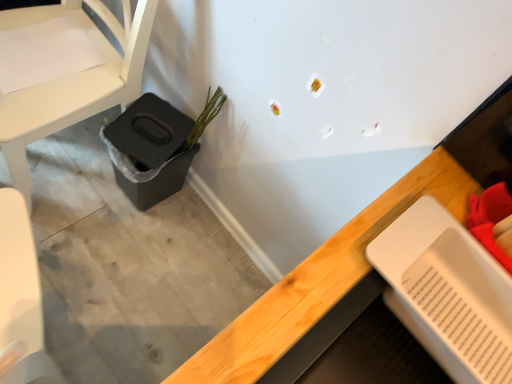
Describe the element at coordinates (149, 150) in the screenshot. The image size is (512, 384). I see `black plastic potty at lower left` at that location.

Where is `green matte plant at lower left`? Image resolution: width=512 pixels, height=384 pixels. green matte plant at lower left is located at coordinates (204, 118).

Locate an element on the screen. Image resolution: width=512 pixels, height=384 pixels. black plastic potty at lower left is located at coordinates (149, 150).

Based on their sizes in the image, would you say white matte chair at left is bigger or smaller than black plastic potty at lower left?

Considering their sizes, white matte chair at left takes up more space than black plastic potty at lower left.

Would you say white matte chair at left is inside or outside black plastic potty at lower left?

white matte chair at left lies outside black plastic potty at lower left.

Is white matte chair at left beside black plastic potty at lower left?

No, white matte chair at left is not with black plastic potty at lower left.

Can you tell me how much white matte chair at left and black plastic potty at lower left differ in facing direction?

white matte chair at left and black plastic potty at lower left are facing 0.000332 degrees away from each other.

Between white matte chair at left and white plastic tray at lower right, which one is positioned in front?

white plastic tray at lower right is in front.

I want to click on desk on the right of white matte chair at left, so click(x=322, y=289).

Could you tell me if white matte chair at left is facing white plastic tray at lower right?

No, white matte chair at left is not aimed at white plastic tray at lower right.

Which is correct: green matte plant at lower left is inside black plastic potty at lower left, or outside of it?

green matte plant at lower left lies outside black plastic potty at lower left.

Can you confirm if green matte plant at lower left is positioned to the right of black plastic potty at lower left?

Yes.

Considering the points (206, 105) and (131, 199), which point is in front, point (206, 105) or point (131, 199)?

The point (206, 105) is more forward.

Is green matte plant at lower left far from black plastic potty at lower left?

green matte plant at lower left is actually quite close to black plastic potty at lower left.

From the image's perspective, which one is positioned lower, black plastic potty at lower left or white matte chair at left?

black plastic potty at lower left.

Between black plastic potty at lower left and white matte chair at left, which one has less height?

black plastic potty at lower left.

Is black plastic potty at lower left far from white matte chair at left?

black plastic potty at lower left is actually quite close to white matte chair at left.

Considering the positions of objects white plastic tray at lower right and white matte chair at left in the image provided, who is more to the right, white plastic tray at lower right or white matte chair at left?

white plastic tray at lower right.

Considering their positions, is white plastic tray at lower right located in front of or behind white matte chair at left?

white plastic tray at lower right is in front of white matte chair at left.

Does point (370, 276) come in front of point (44, 93)?

Yes, point (370, 276) is in front of point (44, 93).

Is white plastic tray at lower right touching white matte chair at left?

No.

Are white matte chair at left and green matte plant at lower left making contact?

white matte chair at left and green matte plant at lower left are clearly separated.

Looking at this image, from a real-world perspective, between white matte chair at left and green matte plant at lower left, who is vertically higher?

green matte plant at lower left.

Would you say white matte chair at left is to the left or to the right of green matte plant at lower left in the picture?

Clearly, white matte chair at left is on the left of green matte plant at lower left in the image.

Is white matte chair at left smaller than green matte plant at lower left?

No.

Is white plastic tray at lower right at the left side of green matte plant at lower left?

No, white plastic tray at lower right is not to the left of green matte plant at lower left.

Who is shorter, white plastic tray at lower right or green matte plant at lower left?

white plastic tray at lower right is shorter.

Looking at this image, from a real-world perspective, who is located lower, white plastic tray at lower right or green matte plant at lower left?

In real-world perspective, green matte plant at lower left is lower.

Are white plastic tray at lower right and green matte plant at lower left located far from each other?

They are positioned close to each other.

Identify the location of potty that is below the white matte chair at left (from the image's perspective). (149, 150).

Image resolution: width=512 pixels, height=384 pixels. I want to click on chair that is behind the white plastic tray at lower right, so click(70, 84).

Which object lies further to the anchor point white plastic tray at lower right, white matte chair at left or black plastic potty at lower left?

Among the two, white matte chair at left is located further to white plastic tray at lower right.

From the image, which object appears to be nearer to white matte chair at left, black plastic potty at lower left or white plastic tray at lower right?

black plastic potty at lower left lies closer to white matte chair at left than the other object.

Consider the image. Considering their positions, is white matte chair at left positioned closer to green matte plant at lower left than black plastic potty at lower left?

black plastic potty at lower left.

Based on their spatial positions, is black plastic potty at lower left or white matte chair at left further from green matte plant at lower left?

white matte chair at left is positioned further to the anchor green matte plant at lower left.

When comparing their distances from green matte plant at lower left, does white matte chair at left or white plastic tray at lower right seem further?

white plastic tray at lower right is positioned further to the anchor green matte plant at lower left.

Considering their positions, is white plastic tray at lower right positioned further to black plastic potty at lower left than white matte chair at left?

white plastic tray at lower right is positioned further to the anchor black plastic potty at lower left.

Based on their spatial positions, is white plastic tray at lower right or green matte plant at lower left closer to black plastic potty at lower left?

green matte plant at lower left.

From the image, which object appears to be farther from white plastic tray at lower right, white matte chair at left or green matte plant at lower left?

Among the two, white matte chair at left is located further to white plastic tray at lower right.

Where is `plant between white matte chair at left and black plastic potty at lower left along the z-axis`? Image resolution: width=512 pixels, height=384 pixels. plant between white matte chair at left and black plastic potty at lower left along the z-axis is located at coordinates (204, 118).

Where is `plant between white matte chair at left and white plastic tray at lower right from left to right`? The width and height of the screenshot is (512, 384). plant between white matte chair at left and white plastic tray at lower right from left to right is located at coordinates (204, 118).

Find the location of a particular element. The width and height of the screenshot is (512, 384). plant between white plastic tray at lower right and black plastic potty at lower left from front to back is located at coordinates [204, 118].

The height and width of the screenshot is (384, 512). Find the location of `potty between white matte chair at left and white plastic tray at lower right from left to right`. potty between white matte chair at left and white plastic tray at lower right from left to right is located at coordinates (149, 150).